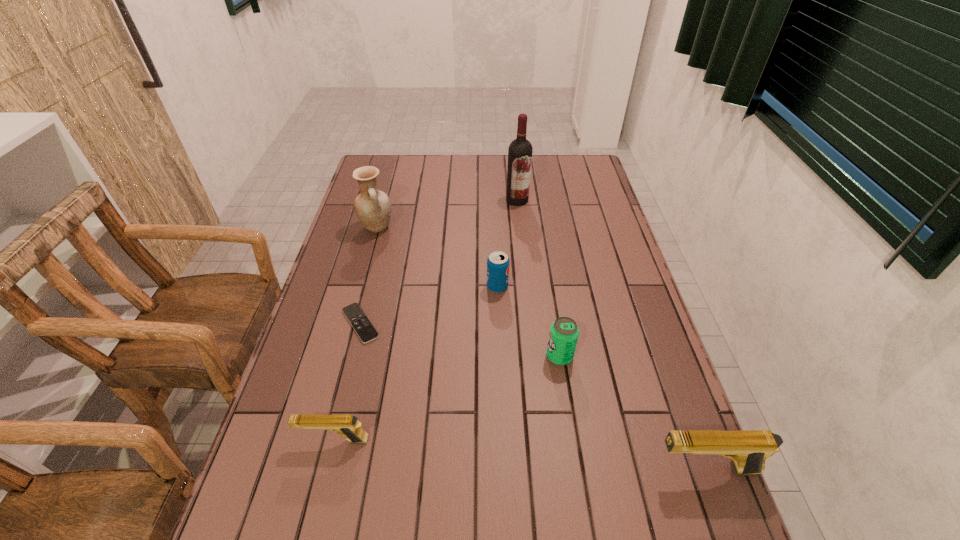
To make them evenly spaced by inserting another pistol among them, please locate a vacant spot for this new pistol. Please provide its 2D coordinates. Your answer should be formatted as a tuple, i.e. [(x, y)], where the tuple contains the x and y coordinates of a point satisfying the conditions above.

[(515, 454)]